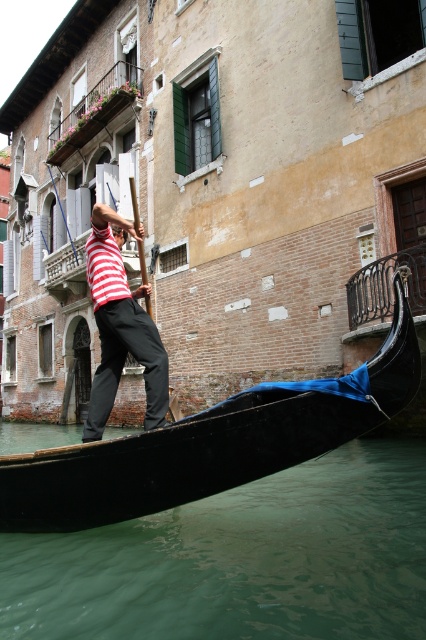
Question: Is green translucent water at lower center positioned behind striped fabric shirt at center?

Choices:
 (A) yes
 (B) no

Answer: (B)

Question: Can you confirm if green translucent water at lower center is smaller than black polished gondola at center?

Choices:
 (A) no
 (B) yes

Answer: (A)

Question: Which of the following is the farthest from the observer?

Choices:
 (A) (348, 428)
 (B) (95, 253)
 (C) (88, 534)

Answer: (B)

Question: Which object is farther from the camera taking this photo?

Choices:
 (A) green translucent water at lower center
 (B) black polished gondola at center

Answer: (B)

Question: Can you confirm if green translucent water at lower center is wider than black polished gondola at center?

Choices:
 (A) yes
 (B) no

Answer: (A)

Question: Among these points, which one is farthest from the camera?

Choices:
 (A) (34, 480)
 (B) (120, 289)
 (C) (393, 545)

Answer: (B)